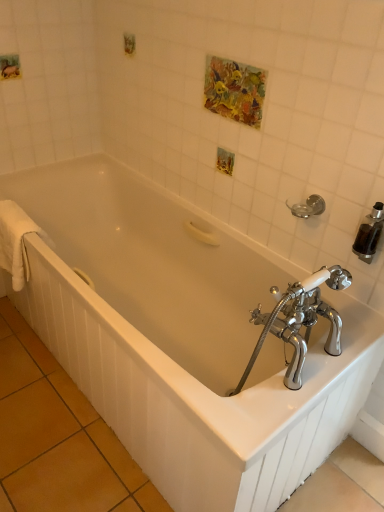
Question: Considering the relative positions of silver metallic towel bar at upper right and white glossy bathtub at center in the image provided, is silver metallic towel bar at upper right to the left or to the right of white glossy bathtub at center?

Choices:
 (A) left
 (B) right

Answer: (B)

Question: From the image's perspective, is silver metallic towel bar at upper right above or below white glossy bathtub at center?

Choices:
 (A) above
 (B) below

Answer: (A)

Question: Which object is the farthest from the white glossy bathtub at center?

Choices:
 (A) silver metallic towel bar at upper right
 (B) white soft towel at left

Answer: (A)

Question: Estimate the real-world distances between objects in this image. Which object is closer to the silver metallic towel bar at upper right?

Choices:
 (A) white glossy bathtub at center
 (B) white soft towel at left

Answer: (A)